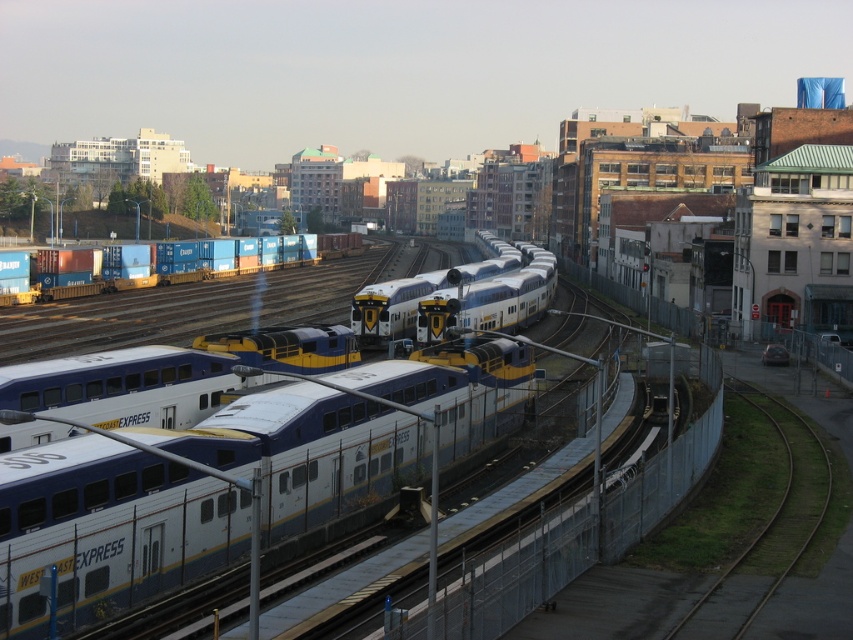
Is white glossy passenger train at center taller than green grass train track at lower right?

Yes, white glossy passenger train at center is taller than green grass train track at lower right.

Does point (467, 403) lie behind point (699, 598)?

Yes, point (467, 403) is behind point (699, 598).

The width and height of the screenshot is (853, 640). What do you see at coordinates (105, 529) in the screenshot?
I see `white glossy passenger train at center` at bounding box center [105, 529].

Find the location of a particular element. Image resolution: width=853 pixels, height=640 pixels. white glossy passenger train at center is located at coordinates coord(105,529).

Is white glossy passenger train at center to the left of blue matte freight container at left from the viewer's perspective?

Incorrect, white glossy passenger train at center is not on the left side of blue matte freight container at left.

Which of these two, white glossy passenger train at center or blue matte freight container at left, stands taller?

blue matte freight container at left is taller.

Locate an element on the screen. This screenshot has height=640, width=853. white glossy passenger train at center is located at coordinates (105, 529).

Is blue matte freight container at left taller than green grass train track at lower right?

Yes.

Does point (119, 285) lie behind point (755, 540)?

Yes.

Where is `blue matte freight container at left`? blue matte freight container at left is located at coordinates (175, 278).

Where is `blue matte freight container at left`? The width and height of the screenshot is (853, 640). blue matte freight container at left is located at coordinates (175, 278).